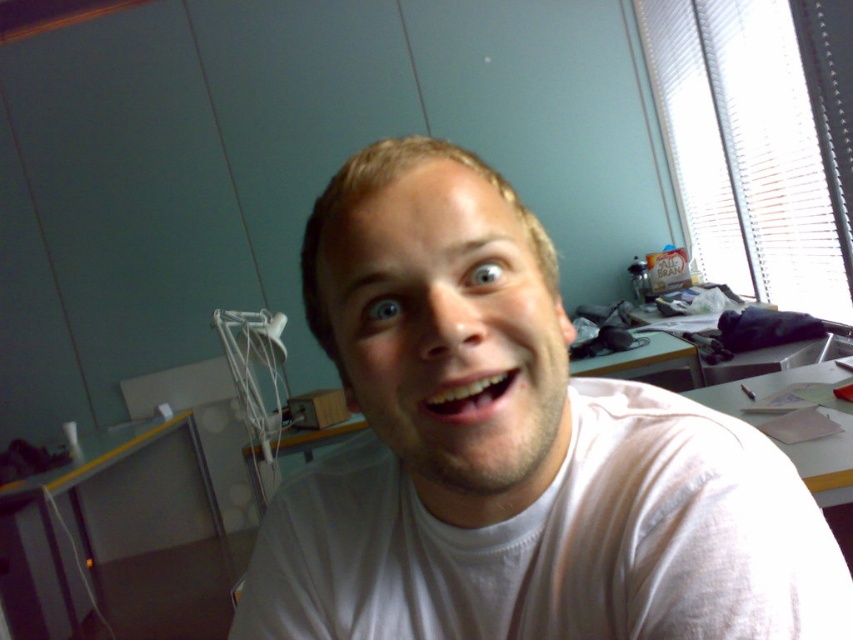
Is point (492, 538) positioned after point (757, 420)?

No, (492, 538) is in front of (757, 420).

In the scene shown: Can you confirm if white cotton t-shirt at center is taller than white paper at lower right?

Yes.

Locate an element on the screen. white cotton t-shirt at center is located at coordinates (560, 541).

The width and height of the screenshot is (853, 640). I want to click on white cotton t-shirt at center, so click(560, 541).